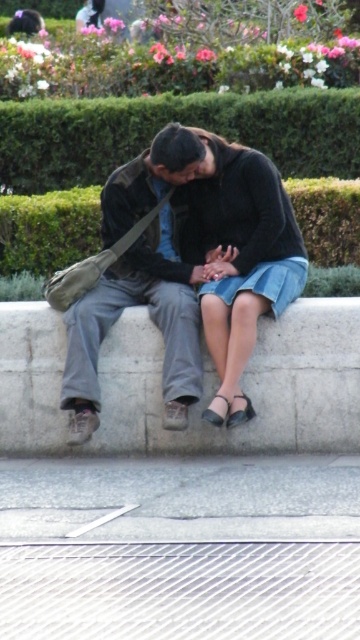
Question: Which point is farther from the camera taking this photo?

Choices:
 (A) (163, 150)
 (B) (335, 225)

Answer: (B)

Question: Which point appears farthest from the camera in this image?

Choices:
 (A) coord(338,184)
 (B) coord(168,406)

Answer: (A)

Question: Among these points, which one is nearest to the camera?

Choices:
 (A) (293, 186)
 (B) (113, 147)
 (C) (61, 429)

Answer: (C)

Question: Where is matte black jacket at center located in relation to green leafy hedge at center in the image?

Choices:
 (A) left
 (B) right

Answer: (B)

Question: In this image, where is matte black jacket at center located relative to green leafy hedge at upper center?

Choices:
 (A) below
 (B) above

Answer: (A)

Question: Does white concrete at center have a larger size compared to green leafy hedge at upper center?

Choices:
 (A) yes
 (B) no

Answer: (B)